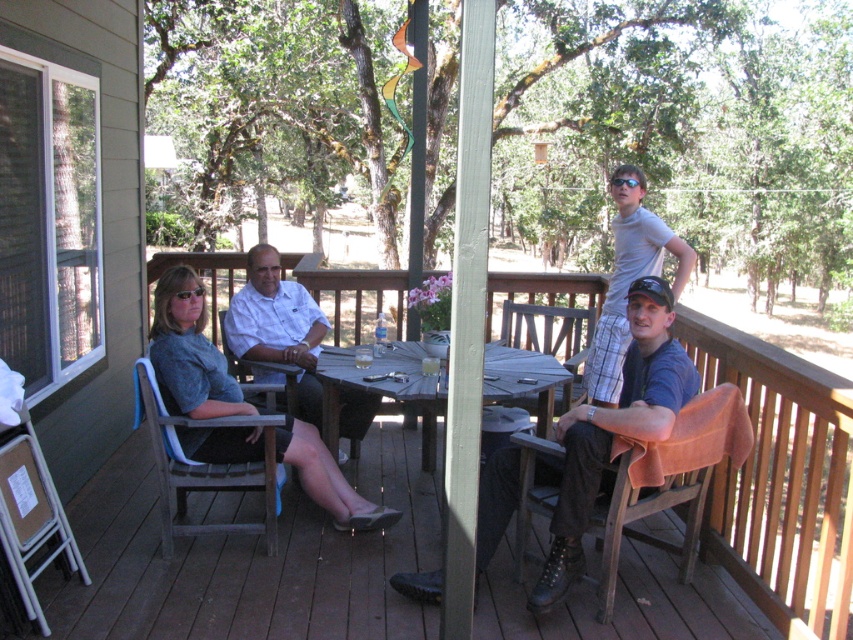
Question: Which of these objects is positioned closest to the dark blue shirt at center?

Choices:
 (A) white cotton shirt at center
 (B) brown wooden chair at lower right
 (C) wooden chair at center

Answer: (B)

Question: Is dark blue shirt at center below light gray plaid shorts at upper right?

Choices:
 (A) no
 (B) yes

Answer: (B)

Question: Does brown wooden chair at lower right lie behind white cotton shirt at center?

Choices:
 (A) yes
 (B) no

Answer: (B)

Question: Which is nearer to the white cotton shirt at center?

Choices:
 (A) dark blue shirt at center
 (B) wooden deck at center
 (C) matte gray shirt at left
 (D) wooden chair at lower left

Answer: (C)

Question: Observing the image, what is the correct spatial positioning of dark blue shirt at center in reference to brown wooden chair at lower right?

Choices:
 (A) above
 (B) below

Answer: (A)

Question: Among these objects, which one is nearest to the camera?

Choices:
 (A) wooden deck at center
 (B) brown wooden chair at lower right
 (C) light gray plaid shorts at upper right
 (D) dark blue shirt at center

Answer: (A)